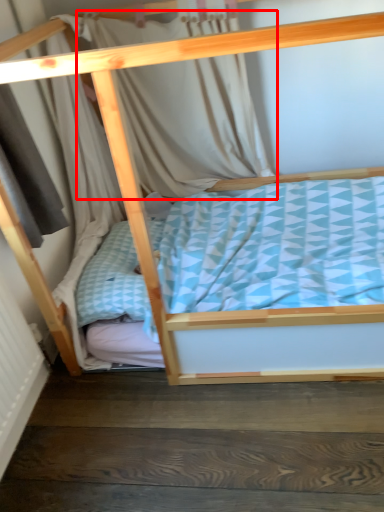
Question: From the image, what is the correct spatial relationship of curtain (annotated by the red box) in relation to stair?

Choices:
 (A) left
 (B) right

Answer: (A)